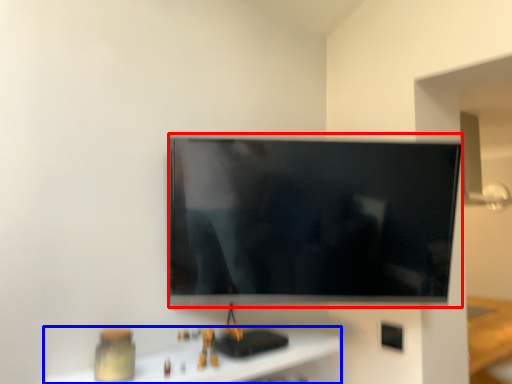
Question: Among these objects, which one is nearest to the camera, television (highlighted by a red box) or furniture (highlighted by a blue box)?

Choices:
 (A) television
 (B) furniture

Answer: (B)